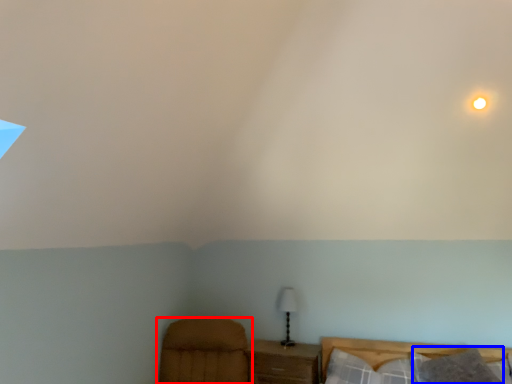
Question: Among these objects, which one is farthest to the camera, furniture (highlighted by a red box) or pillow (highlighted by a blue box)?

Choices:
 (A) furniture
 (B) pillow

Answer: (B)